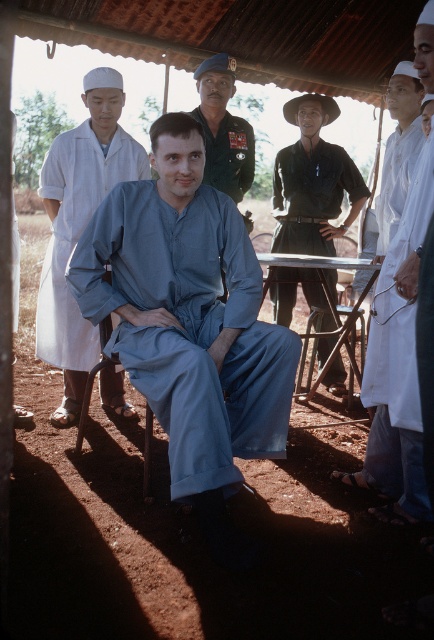
You are a photographer setting up for a group photo. You need to ensure that both the matte blue jumpsuit at center and the dark green military uniform at center are visible in the frame. Based on their positions, which one is closer to the camera?

The matte blue jumpsuit at center is located below the dark green military uniform at center, meaning it is closer to the camera.

You are a photographer setting up a shoot in the scene described. You need to place a light source to the left of the blue cotton jumpsuit at center. Will this light source also be to the left of the matte blue jumpsuit at center?

The matte blue jumpsuit at center is to the right of the blue cotton jumpsuit at center. Placing a light source to the left of the blue cotton jumpsuit at center means it will also be to the left of the matte blue jumpsuit at center since the matte one is positioned further right.